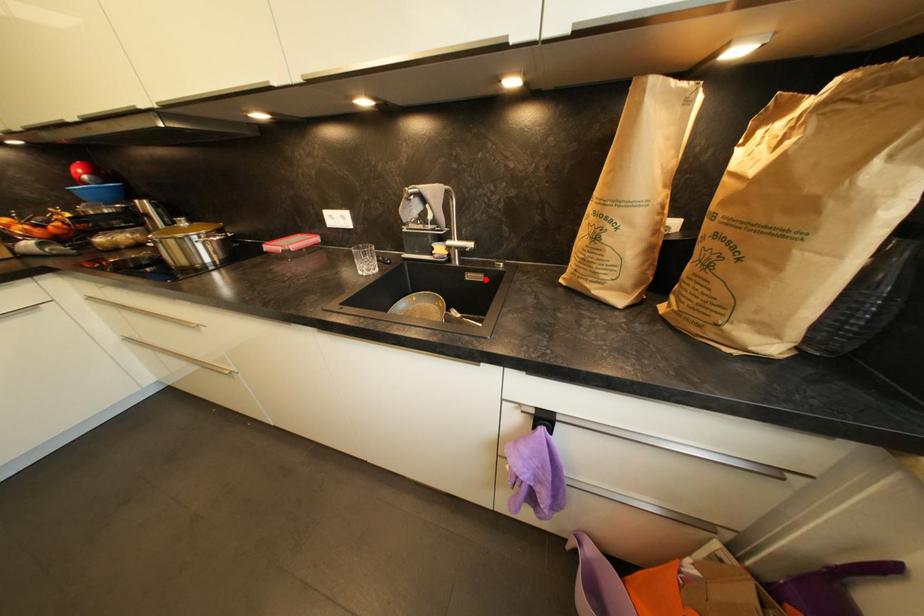
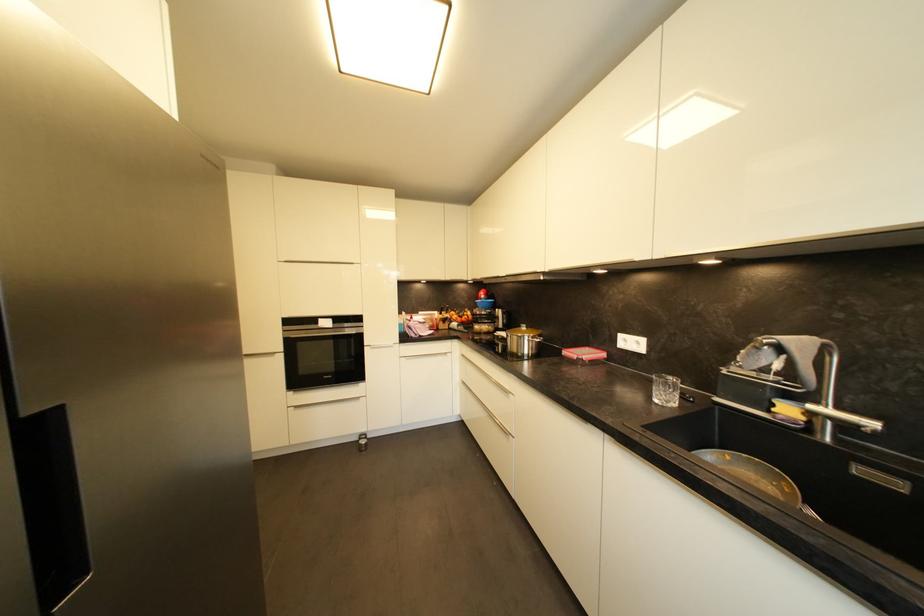
In the second image, find the point that corresponds to the highlighted location in the first image.

(904, 487)